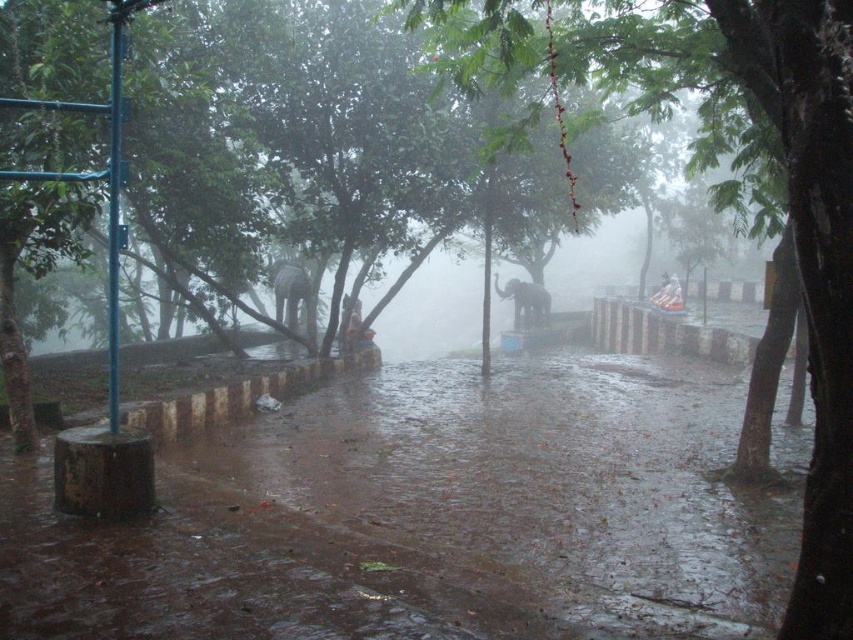
You are standing on the path in the park and see two points marked in the scene. Which point is closer to you, point at coordinate (519, 324) or point at coordinate (671, 285)?

Point at coordinate (519, 324) is closer to you because it is further to the viewer than point at coordinate (671, 285).

You are standing in the park and want to take a photo of the green leafy tree at center. If your camera has a maximum focus range of 10 feet, will you be able to capture the tree clearly without moving closer?

The green leafy tree at center is 9.11 feet away from the viewer, which is within the camera maximum focus range of 10 feet. Therefore, you can capture the tree clearly without moving closer.

You are a gardener who needs to cross the path. You see the wet concrete flood at lower center and the green leafy tree at center. Which one is wider?

The wet concrete flood at lower center is wider than the green leafy tree at center.